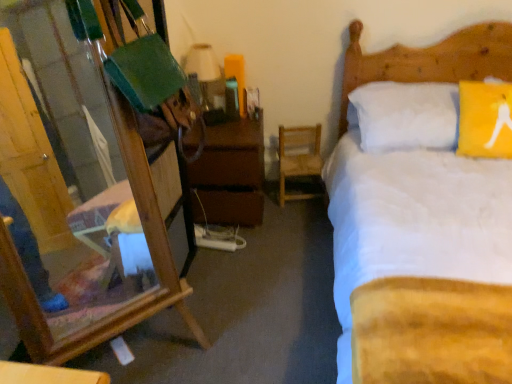
I want to click on empty space that is ontop of brown wooden nightstand at center (from a real-world perspective), so click(x=234, y=126).